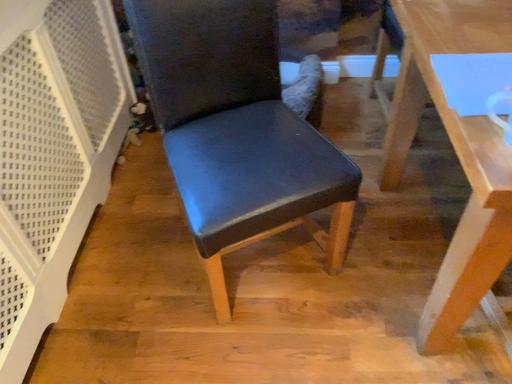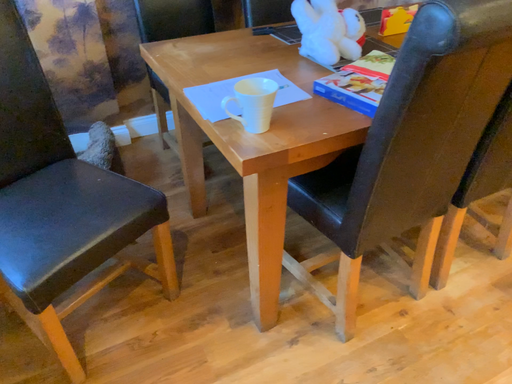
Question: Which way did the camera rotate in the video?

Choices:
 (A) rotated left
 (B) rotated right

Answer: (B)